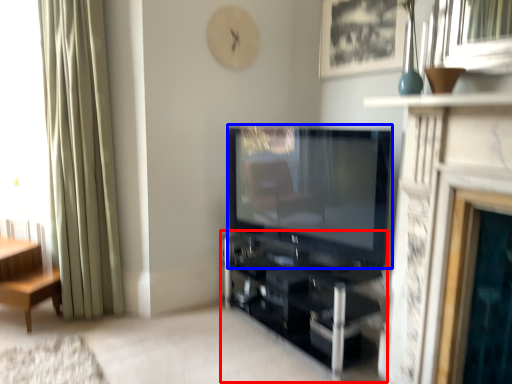
Question: Which object is closer to the camera taking this photo, shelf (highlighted by a red box) or television (highlighted by a blue box)?

Choices:
 (A) shelf
 (B) television

Answer: (B)